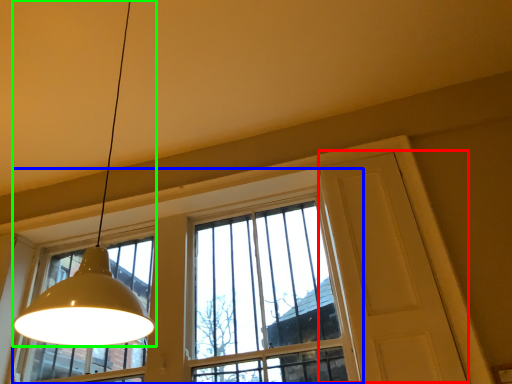
Question: Estimate the real-world distances between objects in this image. Which object is closer to screen door (highlighted by a red box), window (highlighted by a blue box) or lamp (highlighted by a green box)?

Choices:
 (A) window
 (B) lamp

Answer: (A)